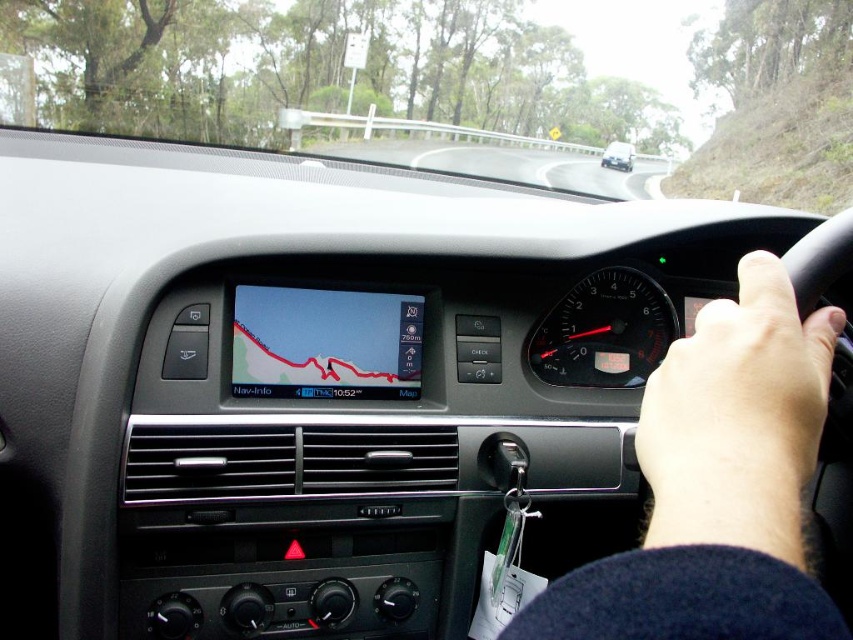
Can you confirm if transparent glass windshield at upper center is positioned to the right of skinny white hand at center right?

Indeed, transparent glass windshield at upper center is positioned on the right side of skinny white hand at center right.

Who is taller, transparent glass windshield at upper center or skinny white hand at center right?

With more height is transparent glass windshield at upper center.

Between point (299, 145) and point (811, 388), which one is positioned in front?

Positioned in front is point (811, 388).

Identify the location of transparent glass windshield at upper center. (445, 88).

Does smooth skin hand at center right have a lesser height compared to matte black sedan at center?

Correct, smooth skin hand at center right is not as tall as matte black sedan at center.

Can you confirm if smooth skin hand at center right is positioned to the right of matte black sedan at center?

No, smooth skin hand at center right is not to the right of matte black sedan at center.

At what (x,y) coordinates should I click in order to perform the action: click on smooth skin hand at center right. Please return your answer as a coordinate pair (x, y). The height and width of the screenshot is (640, 853). Looking at the image, I should click on (717, 484).

Is skinny white hand at center right taller than matte black sedan at center?

No.

Does skinny white hand at center right have a smaller size compared to matte black sedan at center?

Yes, skinny white hand at center right is smaller than matte black sedan at center.

Does point (776, 477) come farther from viewer compared to point (619, 166)?

No, it is in front of (619, 166).

Locate an element on the screen. The height and width of the screenshot is (640, 853). skinny white hand at center right is located at coordinates (740, 401).